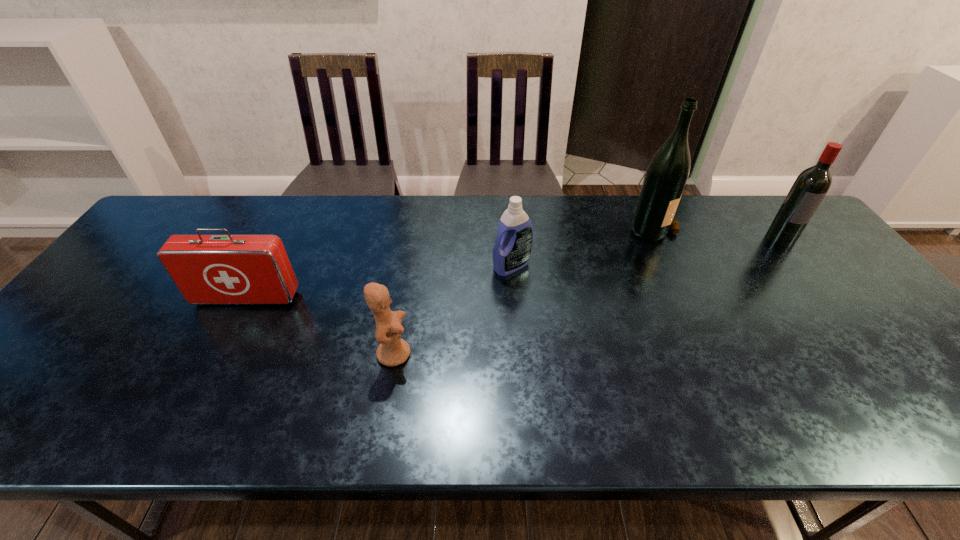
Find the location of `the second object from right to left`. the second object from right to left is located at coordinates (666, 175).

I want to click on the taller wine bottle, so click(x=666, y=175).

Find the location of `the shorter wine bottle`. the shorter wine bottle is located at coordinates (810, 187).

You are a GUI agent. You are given a task and a screenshot of the screen. Output one action in this format:
    pyautogui.click(x=<x>, y=<y>)
    Task: Click on the second tallest object
    
    Given the screenshot: What is the action you would take?
    pyautogui.click(x=810, y=187)

This screenshot has height=540, width=960. I want to click on the second nearest object, so click(208, 269).

Where is `the leftmost object`? Image resolution: width=960 pixels, height=540 pixels. the leftmost object is located at coordinates (208, 269).

What are the coordinates of `detergent` in the screenshot? It's located at (511, 252).

Image resolution: width=960 pixels, height=540 pixels. I want to click on the third farthest object, so [511, 252].

Identify the location of figurine. (392, 351).

In order to click on the second object from left to right in this screenshot , I will do coord(392,351).